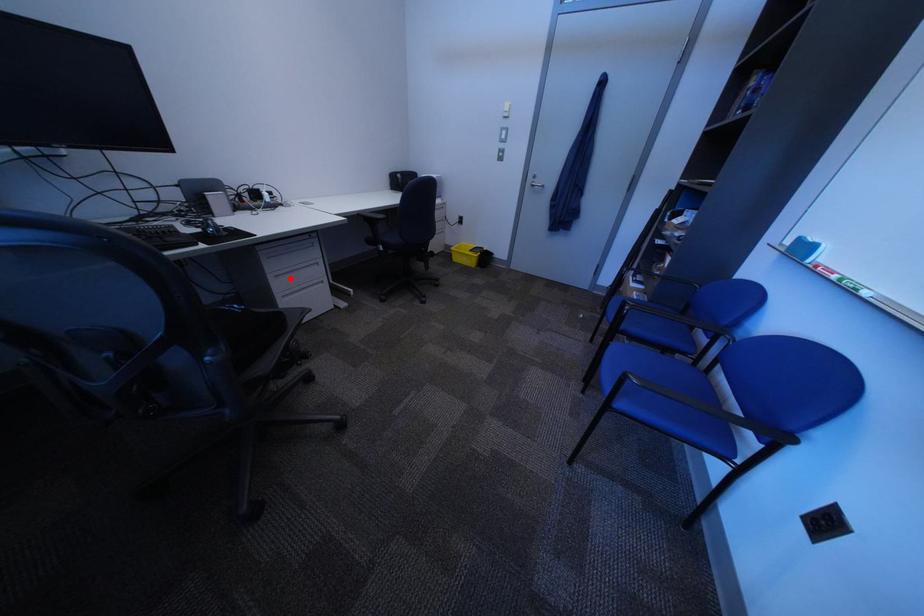
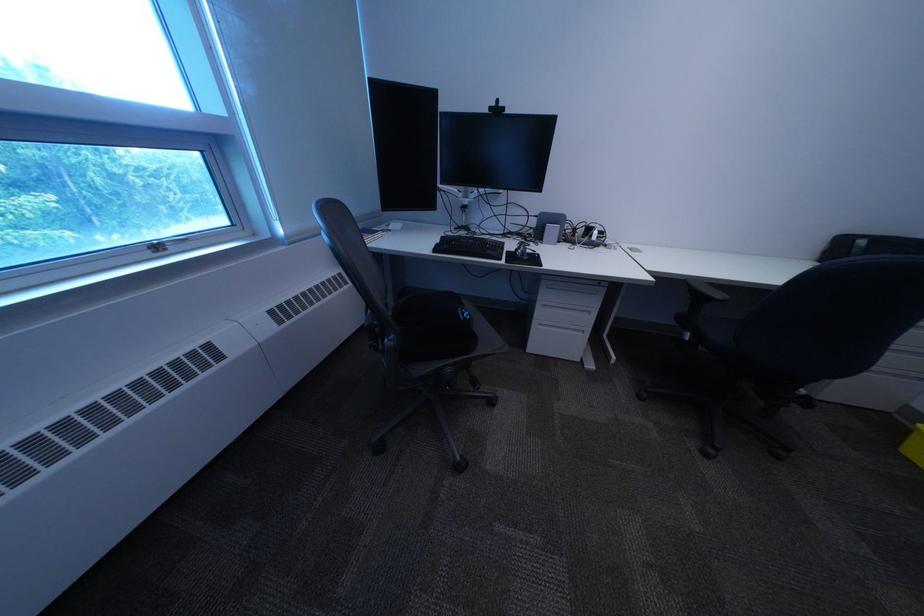
Where in the second image is the point corresponding to the highlighted location from the first image?

(558, 307)